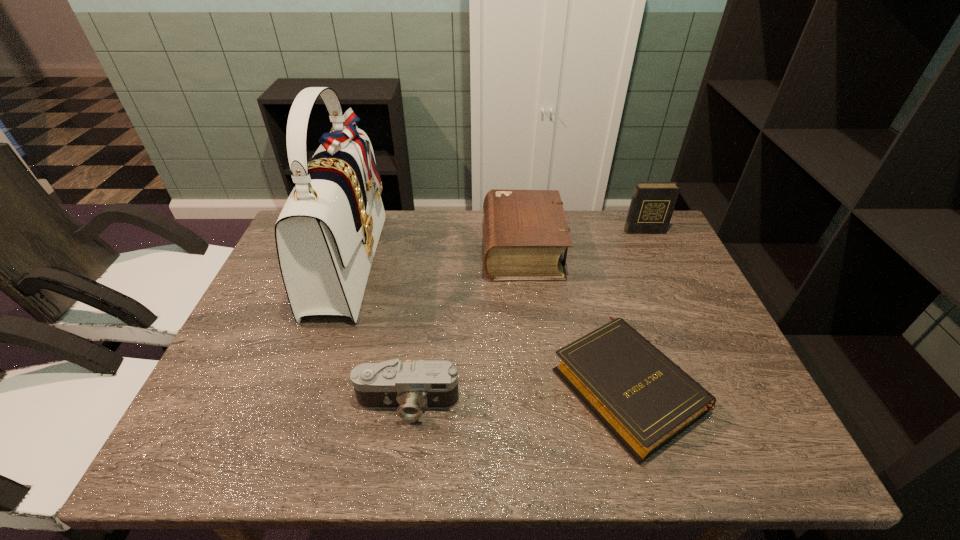
Locate an element on the screen. Image resolution: width=960 pixels, height=540 pixels. free space located 0.110m on the front cover of the diary is located at coordinates (656, 256).

This screenshot has height=540, width=960. In order to click on vacant space located on the spine side of the farther Bible in this screenshot , I will do `click(410, 249)`.

The width and height of the screenshot is (960, 540). Identify the location of free spot located 0.330m on the spine side of the farther Bible. (374, 249).

This screenshot has height=540, width=960. Find the location of `vacant space located on the spine side of the farther Bible`. vacant space located on the spine side of the farther Bible is located at coordinates (450, 249).

What are the coordinates of `free space located 0.080m on the lens of the second object from left to right` in the screenshot? It's located at (399, 462).

You are a GUI agent. You are given a task and a screenshot of the screen. Output one action in this format:
    pyautogui.click(x=<x>, y=<y>)
    Task: Click on the free space located 0.140m on the left of the shorter Bible
    Image resolution: width=960 pixels, height=540 pixels.
    Given the screenshot: What is the action you would take?
    pyautogui.click(x=492, y=386)

I want to click on satchel that is at the far edge, so click(327, 233).

Where is `diary present at the far edge`? The image size is (960, 540). diary present at the far edge is located at coordinates (652, 204).

At what (x,y) coordinates should I click in order to perform the action: click on Bible that is at the far edge. Please return your answer as a coordinate pair (x, y). Looking at the image, I should click on (525, 232).

Find the location of a particular element. The image size is (960, 540). camera that is at the near edge is located at coordinates (409, 387).